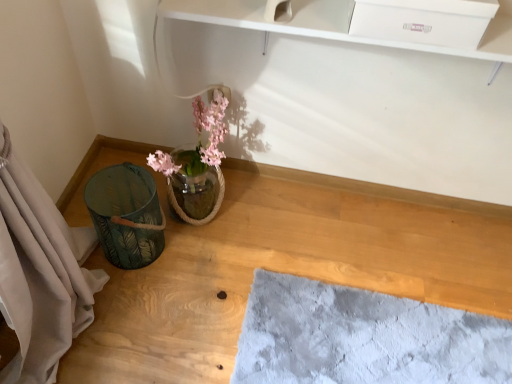
Question: Considering the relative sizes of translucent glass vase at center and green fabric basket at lower left in the image provided, is translucent glass vase at center bigger than green fabric basket at lower left?

Choices:
 (A) yes
 (B) no

Answer: (B)

Question: Is translucent glass vase at center in front of green fabric basket at lower left?

Choices:
 (A) no
 (B) yes

Answer: (A)

Question: Considering the relative sizes of translucent glass vase at center and green fabric basket at lower left in the image provided, is translucent glass vase at center smaller than green fabric basket at lower left?

Choices:
 (A) yes
 (B) no

Answer: (A)

Question: Is translucent glass vase at center at the left side of green fabric basket at lower left?

Choices:
 (A) yes
 (B) no

Answer: (A)

Question: From a real-world perspective, is translucent glass vase at center located beneath green fabric basket at lower left?

Choices:
 (A) no
 (B) yes

Answer: (A)

Question: In the image, is green fabric basket at lower left on the left side or the right side of white glossy drawer at upper center?

Choices:
 (A) left
 (B) right

Answer: (A)

Question: Is green fabric basket at lower left inside the boundaries of white glossy drawer at upper center, or outside?

Choices:
 (A) inside
 (B) outside

Answer: (B)

Question: Is point (170, 314) positioned closer to the camera than point (374, 1)?

Choices:
 (A) farther
 (B) closer

Answer: (A)

Question: Considering the positions of green fabric basket at lower left and white glossy drawer at upper center in the image, is green fabric basket at lower left wider or thinner than white glossy drawer at upper center?

Choices:
 (A) wide
 (B) thin

Answer: (A)

Question: Considering their positions, is green leaf-patterned basket at left located in front of or behind white glossy drawer at upper center?

Choices:
 (A) front
 (B) behind

Answer: (B)

Question: From a real-world perspective, is green leaf-patterned basket at left positioned above or below white glossy drawer at upper center?

Choices:
 (A) above
 (B) below

Answer: (B)

Question: Looking at the image, does green leaf-patterned basket at left seem bigger or smaller compared to white glossy drawer at upper center?

Choices:
 (A) small
 (B) big

Answer: (B)

Question: Is green leaf-patterned basket at left taller or shorter than white glossy drawer at upper center?

Choices:
 (A) short
 (B) tall

Answer: (B)

Question: Based on their positions, is green fabric basket at lower left located to the left or right of green leaf-patterned basket at left?

Choices:
 (A) left
 (B) right

Answer: (B)

Question: In terms of width, does green fabric basket at lower left look wider or thinner when compared to green leaf-patterned basket at left?

Choices:
 (A) thin
 (B) wide

Answer: (B)